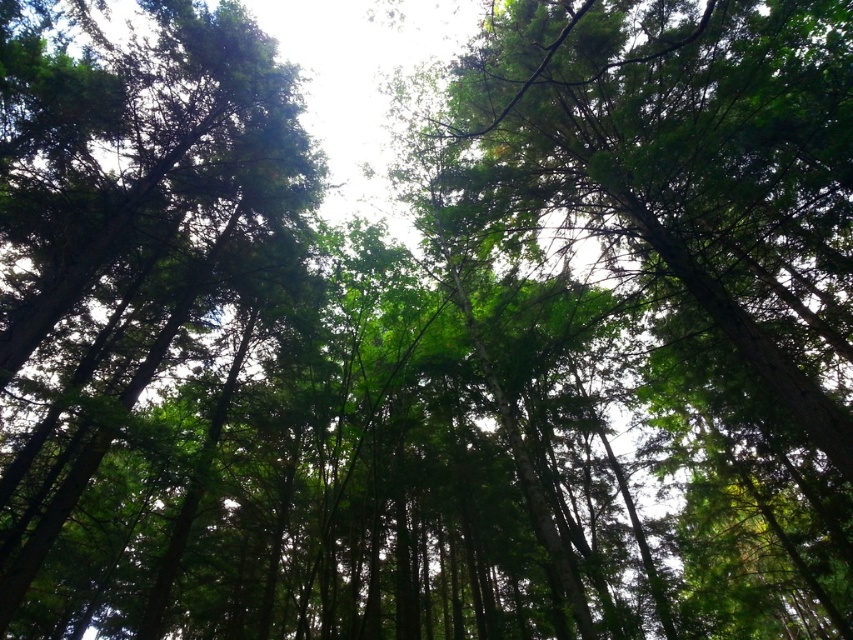
You are standing in the forest and looking up at the trees. You want to take a photo of the green leafy tree at center. Where should you aim your camera to capture the tree in the frame?

You should aim your camera at point (x=692, y=248) to capture the green leafy tree at center in the frame.

You are a bird looking for a place to perch. You see the green leafy tree at center and the green matte tree at upper left. Which tree is closer to the ground?

The green leafy tree at center is positioned under the green matte tree at upper left, so it is closer to the ground.